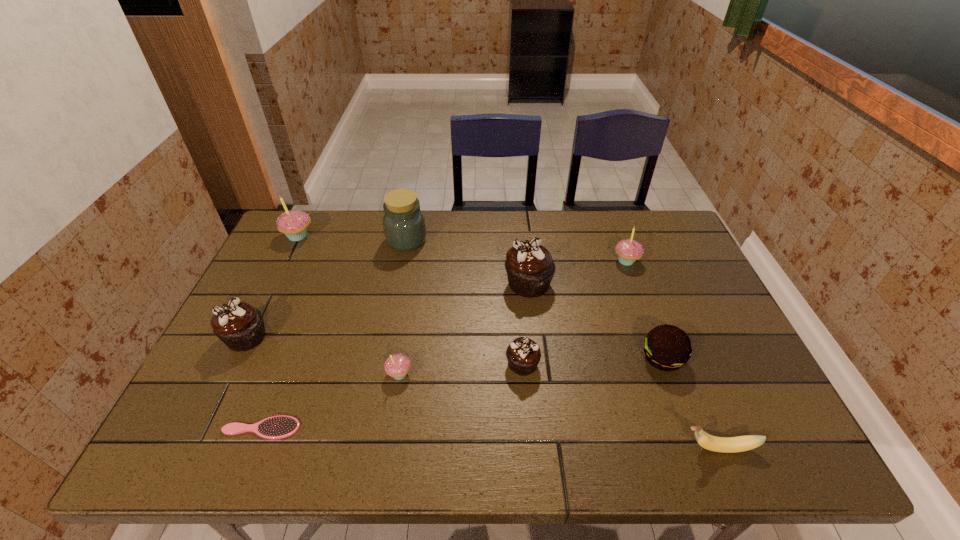
The image size is (960, 540). I want to click on vacant area that satisfies the following two spatial constraints: 1. on the back side of the second smallest pink cupcake; 2. on the left side of the leftmost brown cupcake, so click(x=284, y=261).

Identify the location of vacant region that satisfies the following two spatial constraints: 1. on the back side of the smallest brown cupcake; 2. on the right side of the patty. (522, 358).